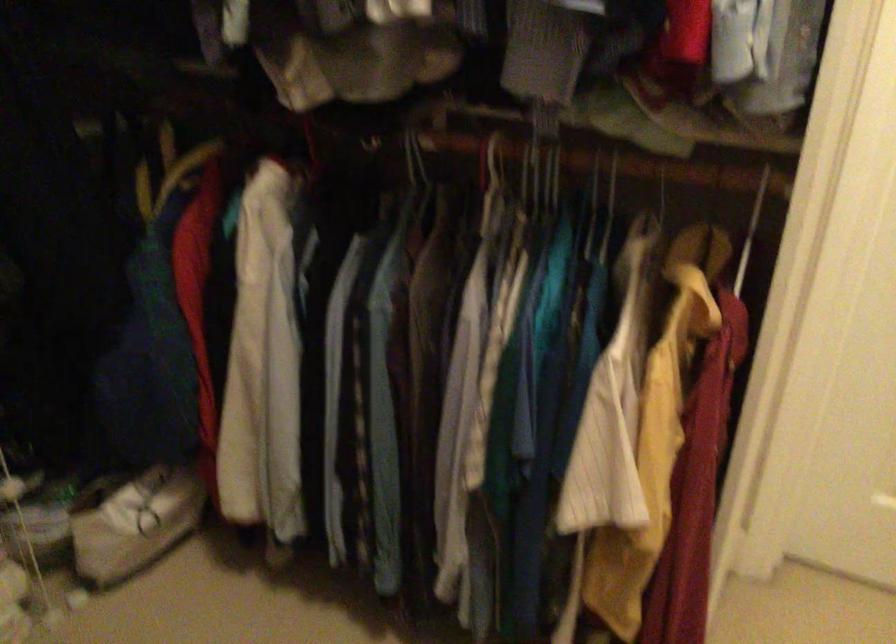
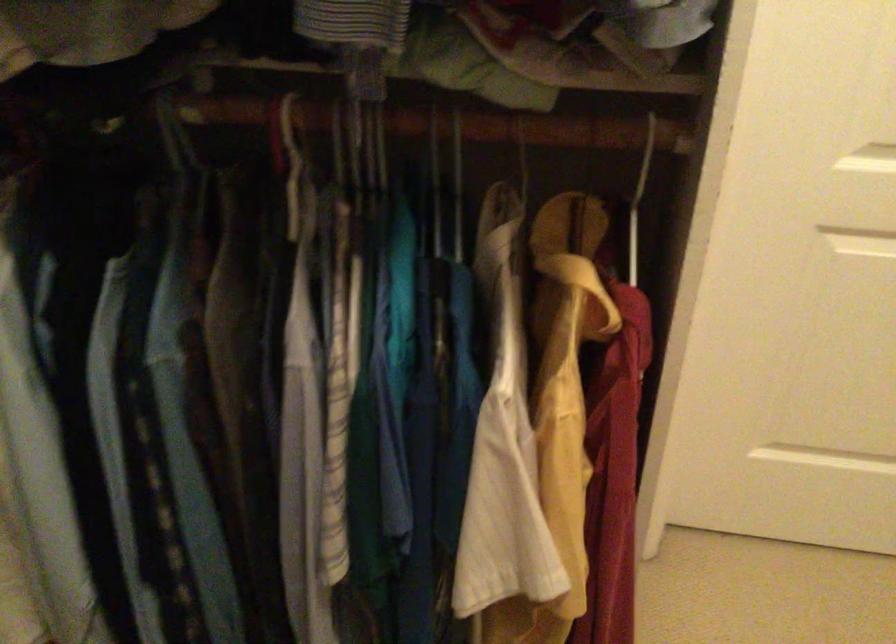
Find the pixel in the second image that matches (x=554, y=176) in the first image.

(378, 149)